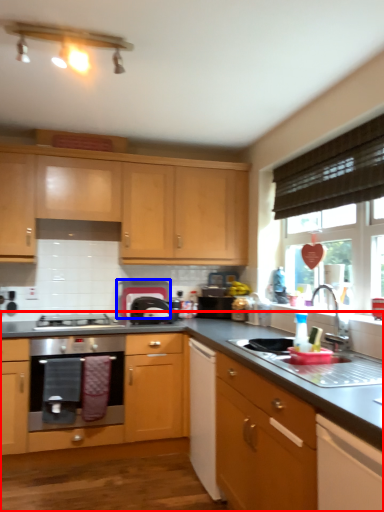
Question: Which point is further to the camera, countertop (highlighted by a red box) or appliance (highlighted by a blue box)?

Choices:
 (A) countertop
 (B) appliance

Answer: (B)